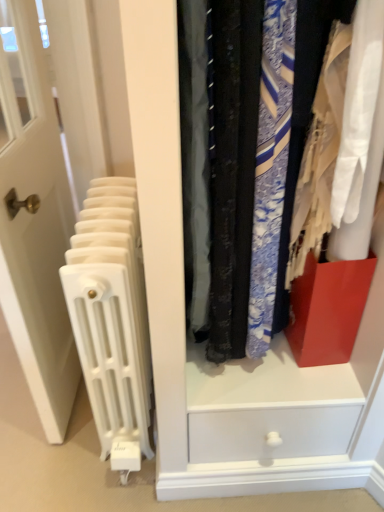
Question: Is white plastic radiator at left in front of or behind white glossy door at left in the image?

Choices:
 (A) front
 (B) behind

Answer: (B)

Question: Would you say white plastic radiator at left is to the left or to the right of white glossy door at left in the picture?

Choices:
 (A) right
 (B) left

Answer: (A)

Question: Considering the real-world distances, which object is farthest from the white plastic radiator at left?

Choices:
 (A) white glossy door at left
 (B) matte plastic drawer at center

Answer: (B)

Question: Which of these objects is positioned farthest from the matte plastic drawer at center?

Choices:
 (A) white plastic radiator at left
 (B) white glossy door at left

Answer: (B)